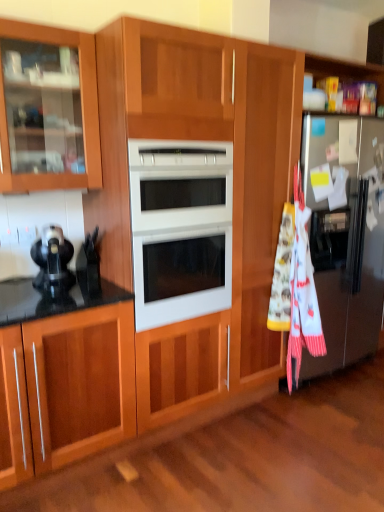
Question: Is matte black coffee maker at left at the back of silver metallic refrigerator at right?

Choices:
 (A) yes
 (B) no

Answer: (B)

Question: From a real-world perspective, is silver metallic refrigerator at right over matte black coffee maker at left?

Choices:
 (A) no
 (B) yes

Answer: (A)

Question: Is silver metallic refrigerator at right wider than matte black coffee maker at left?

Choices:
 (A) no
 (B) yes

Answer: (B)

Question: Considering the relative sizes of silver metallic refrigerator at right and matte black coffee maker at left in the image provided, is silver metallic refrigerator at right bigger than matte black coffee maker at left?

Choices:
 (A) yes
 (B) no

Answer: (A)

Question: Is silver metallic refrigerator at right at the right side of matte black coffee maker at left?

Choices:
 (A) no
 (B) yes

Answer: (B)

Question: In terms of size, does matte black coffee maker at left appear bigger or smaller than silver metallic refrigerator at right?

Choices:
 (A) big
 (B) small

Answer: (B)

Question: From their relative heights in the image, would you say matte black coffee maker at left is taller or shorter than silver metallic refrigerator at right?

Choices:
 (A) tall
 (B) short

Answer: (B)

Question: Does point (66, 278) appear closer or farther from the camera than point (355, 258)?

Choices:
 (A) farther
 (B) closer

Answer: (B)

Question: Considering the positions of matte black coffee maker at left and silver metallic refrigerator at right in the image, is matte black coffee maker at left wider or thinner than silver metallic refrigerator at right?

Choices:
 (A) wide
 (B) thin

Answer: (B)

Question: Would you say matte black coffee maker at left is to the left or to the right of white cotton beach towel at right in the picture?

Choices:
 (A) left
 (B) right

Answer: (A)

Question: Do you think matte black coffee maker at left is within white cotton beach towel at right, or outside of it?

Choices:
 (A) inside
 (B) outside

Answer: (B)

Question: From the image's perspective, is matte black coffee maker at left positioned above or below white cotton beach towel at right?

Choices:
 (A) above
 (B) below

Answer: (A)

Question: Considering their positions, is matte black coffee maker at left located in front of or behind white cotton beach towel at right?

Choices:
 (A) front
 (B) behind

Answer: (A)

Question: Considering the positions of white cotton beach towel at right and silver metallic refrigerator at right in the image, is white cotton beach towel at right taller or shorter than silver metallic refrigerator at right?

Choices:
 (A) short
 (B) tall

Answer: (A)

Question: In the image, is white cotton beach towel at right on the left side or the right side of silver metallic refrigerator at right?

Choices:
 (A) right
 (B) left

Answer: (B)